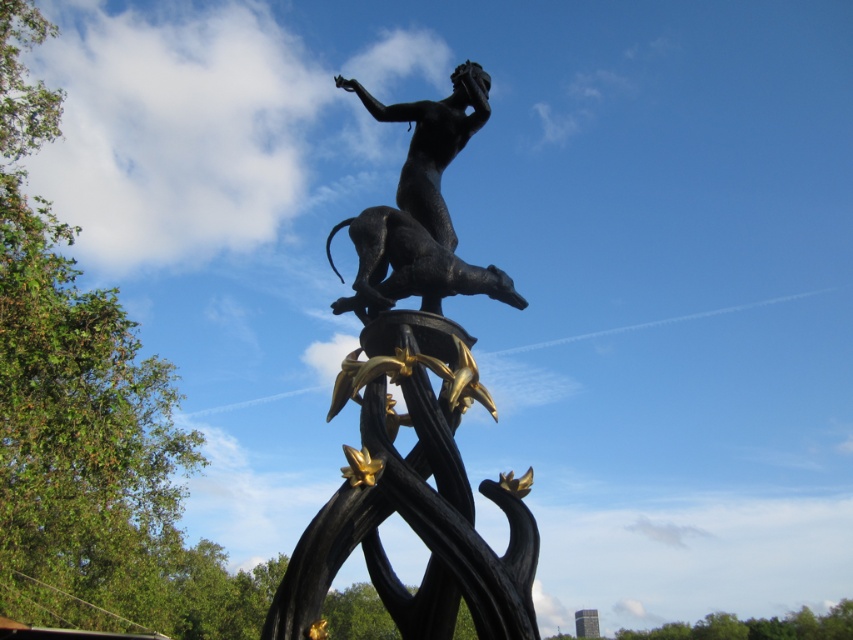
Can you confirm if black polished statue at center is thinner than black polished statue at upper center?

In fact, black polished statue at center might be wider than black polished statue at upper center.

Is black polished statue at center closer to the viewer compared to black polished statue at upper center?

Yes, it is.

Who is more distant from viewer, [408,461] or [399,113]?

The point [399,113] is behind.

Where is `black polished statue at center`? The width and height of the screenshot is (853, 640). black polished statue at center is located at coordinates tap(416, 408).